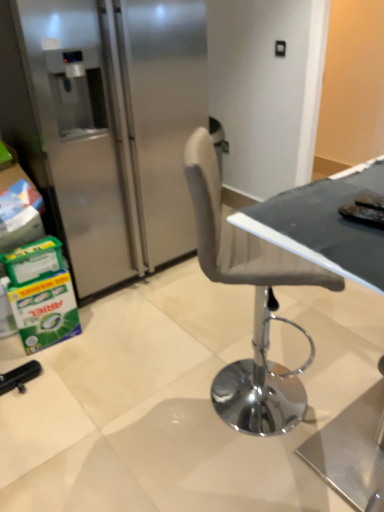
What do you see at coordinates (325, 224) in the screenshot? Image resolution: width=384 pixels, height=512 pixels. I see `matte black table at center` at bounding box center [325, 224].

I want to click on matte black table at center, so click(x=325, y=224).

Measure the distance between matte black table at center and camera.

matte black table at center and camera are 24.84 inches apart from each other.

Describe the element at coordinates (107, 124) in the screenshot. I see `satin silver refrigerator at left` at that location.

You are a GUI agent. You are given a task and a screenshot of the screen. Output one action in this format:
    pyautogui.click(x=<x>, y=<y>)
    Task: Click on the satin silver refrigerator at left
    The image size is (384, 512).
    Given the screenshot: What is the action you would take?
    pyautogui.click(x=107, y=124)

Find the location of a particular element. matte black table at center is located at coordinates (325, 224).

Is satin silver refrigerator at left at the left side of matte black table at center?

Yes.

In the image, is satin silver refrigerator at left positioned in front of or behind matte black table at center?

satin silver refrigerator at left is behind matte black table at center.

Which is closer to the camera, (51, 146) or (314, 220)?

Point (314, 220)

From the image's perspective, which one is positioned higher, satin silver refrigerator at left or matte black table at center?

satin silver refrigerator at left.

From a real-world perspective, is satin silver refrigerator at left physically located above or below matte black table at center?

Clearly, from a real-world perspective, satin silver refrigerator at left is below matte black table at center.

Considering the sizes of objects satin silver refrigerator at left and matte black table at center in the image provided, who is thinner, satin silver refrigerator at left or matte black table at center?

With smaller width is matte black table at center.

Which of these two, satin silver refrigerator at left or matte black table at center, stands taller?

satin silver refrigerator at left.

Considering the sizes of objects satin silver refrigerator at left and matte black table at center in the image provided, who is smaller, satin silver refrigerator at left or matte black table at center?

Smaller between the two is matte black table at center.

Is satin silver refrigerator at left not within matte black table at center?

satin silver refrigerator at left lies outside matte black table at center's area.

Is satin silver refrigerator at left far away from matte black table at center?

Yes.

Is satin silver refrigerator at left looking in the opposite direction of matte black table at center?

No.

What's the angular difference between satin silver refrigerator at left and matte black table at center's facing directions?

The facing directions of satin silver refrigerator at left and matte black table at center are 6.05 degrees apart.

How much distance is there between satin silver refrigerator at left and matte black table at center?

satin silver refrigerator at left and matte black table at center are 1.30 meters apart from each other.

In order to click on refrigerator on the left of the matte black table at center in this screenshot , I will do `click(107, 124)`.

Which is more to the right, matte black table at center or satin silver refrigerator at left?

Positioned to the right is matte black table at center.

Is matte black table at center in front of satin silver refrigerator at left?

That is True.

Considering the points (288, 222) and (165, 42), which point is behind, point (288, 222) or point (165, 42)?

The point (165, 42) is farther.

From the picture: From the image's perspective, is matte black table at center positioned above or below satin silver refrigerator at left?

Clearly, from the image's perspective, matte black table at center is below satin silver refrigerator at left.

From a real-world perspective, is matte black table at center positioned under satin silver refrigerator at left based on gravity?

Actually, matte black table at center is physically above satin silver refrigerator at left in the real world.

Does matte black table at center have a lesser width compared to satin silver refrigerator at left?

Yes, matte black table at center is thinner than satin silver refrigerator at left.

Is matte black table at center taller than satin silver refrigerator at left?

No.

Can you confirm if matte black table at center is smaller than satin silver refrigerator at left?

Indeed, matte black table at center has a smaller size compared to satin silver refrigerator at left.

Is satin silver refrigerator at left a part of matte black table at center?

No, satin silver refrigerator at left is located outside of matte black table at center.

Is matte black table at center far from satin silver refrigerator at left?

Yes, matte black table at center and satin silver refrigerator at left are located far from each other.

Is satin silver refrigerator at left at the back of matte black table at center?

Yes, matte black table at center is positioned with its back facing satin silver refrigerator at left.

Can you tell me how much matte black table at center and satin silver refrigerator at left differ in facing direction?

They differ by 6.05 degrees in their facing directions.

At what (x,y) coordinates should I click in order to perform the action: click on table that is above the satin silver refrigerator at left (from a real-world perspective). Please return your answer as a coordinate pair (x, y). The height and width of the screenshot is (512, 384). Looking at the image, I should click on (325, 224).

Where is `refrigerator behind the matte black table at center`? refrigerator behind the matte black table at center is located at coordinates (107, 124).

Where is `refrigerator that is on the left side of matte black table at center`? refrigerator that is on the left side of matte black table at center is located at coordinates (107, 124).